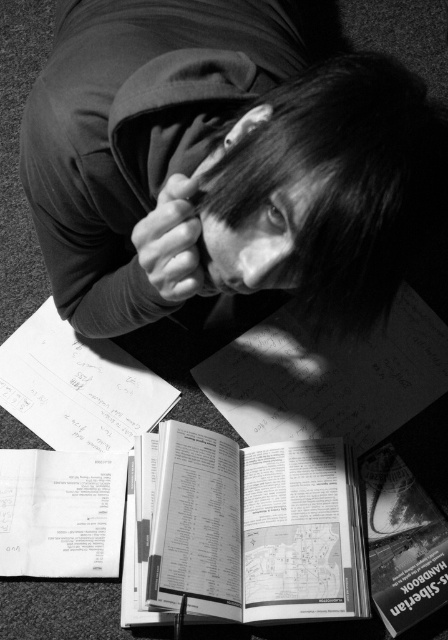
You are organizing a study session and need to stack the white paper at center and the white paper at lower left. Which paper should you place at the bottom to ensure stability?

The white paper at center has a greater height compared to white paper at lower left, so placing the taller white paper at center at the bottom will provide a more stable base for stacking.

You are a photographer analyzing this image. You need to determine if the smooth hair at center can be fully framed within the white paper at center without cropping. Based on their sizes, can this be done?

The smooth hair at center has a lesser width compared to white paper at center, so it can be fully framed within the white paper at center without cropping.

You are a photographer analyzing the composition of this image. You notice the black matte hair at upper center and the smooth skin hand at center. Which object is placed higher in the image?

The black matte hair at upper center is positioned over the smooth skin hand at center, so it is higher in the image.